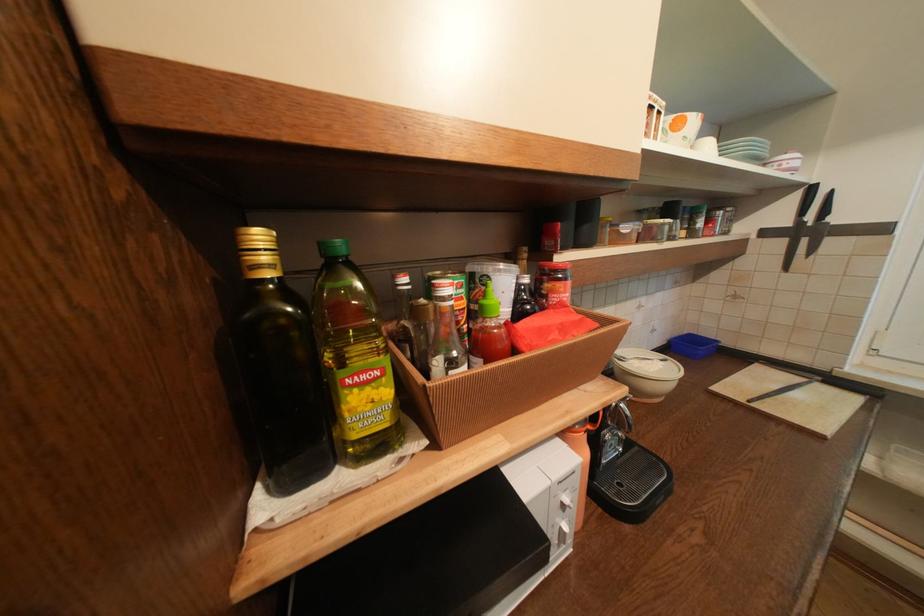
The height and width of the screenshot is (616, 924). What are the coordinates of `dark glass bottle` in the screenshot? It's located at (280, 370).